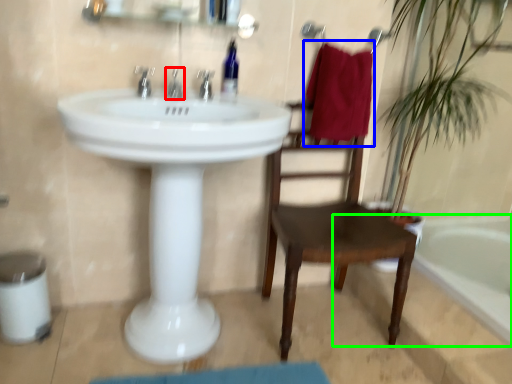
Question: Which object is the farthest from tap (highlighted by a red box)? Choose among these: beach towel (highlighted by a blue box) or bathtub (highlighted by a green box).

Choices:
 (A) beach towel
 (B) bathtub

Answer: (B)